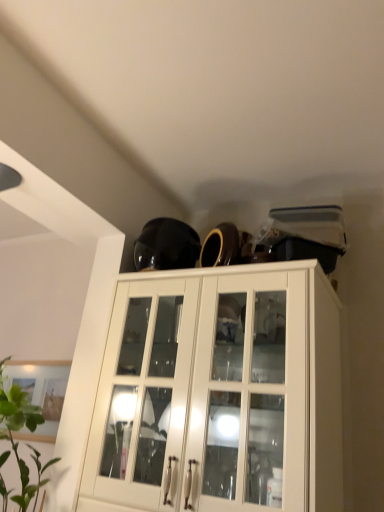
Question: Is green leafy plant at lower left completely or partially outside of white glossy cabinet at upper center?

Choices:
 (A) yes
 (B) no

Answer: (A)

Question: Are green leafy plant at lower left and white glossy cabinet at upper center located far from each other?

Choices:
 (A) no
 (B) yes

Answer: (A)

Question: Does green leafy plant at lower left appear on the left side of white glossy cabinet at upper center?

Choices:
 (A) no
 (B) yes

Answer: (B)

Question: Is green leafy plant at lower left oriented away from white glossy cabinet at upper center?

Choices:
 (A) no
 (B) yes

Answer: (A)

Question: Considering the relative sizes of green leafy plant at lower left and white glossy cabinet at upper center in the image provided, is green leafy plant at lower left wider than white glossy cabinet at upper center?

Choices:
 (A) no
 (B) yes

Answer: (A)

Question: From a real-world perspective, does green leafy plant at lower left stand above white glossy cabinet at upper center?

Choices:
 (A) yes
 (B) no

Answer: (B)

Question: Does white glossy cabinet at upper center have a larger size compared to green leafy plant at lower left?

Choices:
 (A) no
 (B) yes

Answer: (B)

Question: From the image's perspective, is white glossy cabinet at upper center beneath green leafy plant at lower left?

Choices:
 (A) no
 (B) yes

Answer: (B)

Question: From a real-world perspective, does white glossy cabinet at upper center stand above green leafy plant at lower left?

Choices:
 (A) yes
 (B) no

Answer: (A)

Question: Can you confirm if white glossy cabinet at upper center is positioned to the left of green leafy plant at lower left?

Choices:
 (A) yes
 (B) no

Answer: (B)

Question: Can you confirm if white glossy cabinet at upper center is thinner than green leafy plant at lower left?

Choices:
 (A) no
 (B) yes

Answer: (A)

Question: Does white glossy cabinet at upper center have a lesser height compared to green leafy plant at lower left?

Choices:
 (A) yes
 (B) no

Answer: (B)

Question: Is point (279, 399) closer or farther from the camera than point (26, 505)?

Choices:
 (A) closer
 (B) farther

Answer: (B)